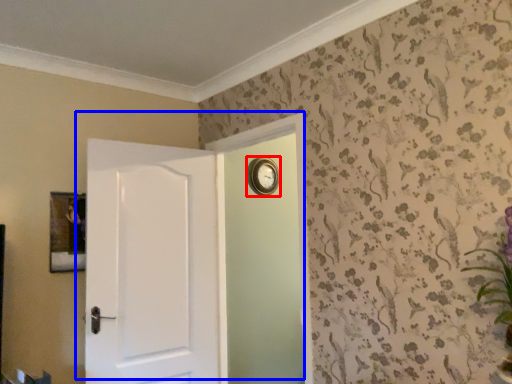
Question: Which object appears farthest to the camera in this image, clock (highlighted by a red box) or door (highlighted by a blue box)?

Choices:
 (A) clock
 (B) door

Answer: (A)